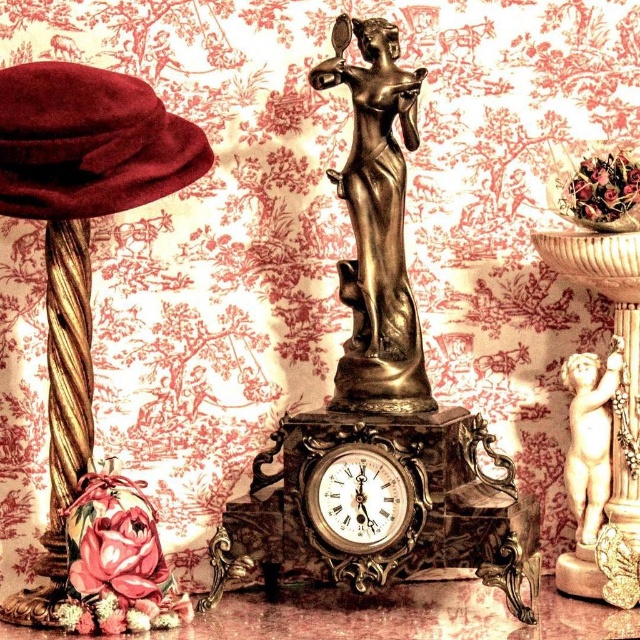
Question: Which object is farther from the camera taking this photo?

Choices:
 (A) bronze statue at center
 (B) smooth beige cherub at right
 (C) velvet maroon hat at left

Answer: (B)

Question: Is bronze statue at center further to camera compared to gold-toned metal clock at center?

Choices:
 (A) yes
 (B) no

Answer: (A)

Question: Which object appears closest to the camera in this image?

Choices:
 (A) smooth beige cherub at right
 (B) velvet maroon hat at left

Answer: (B)

Question: Can you confirm if velvet maroon hat at left is positioned to the left of smooth beige cherub at right?

Choices:
 (A) no
 (B) yes

Answer: (B)

Question: Does bronze statue at center appear over gold-toned metal clock at center?

Choices:
 (A) no
 (B) yes

Answer: (B)

Question: Based on their relative distances, which object is nearer to the bronze statue at center?

Choices:
 (A) gold-toned metal clock at center
 (B) smooth beige cherub at right
 (C) velvet maroon hat at left

Answer: (A)